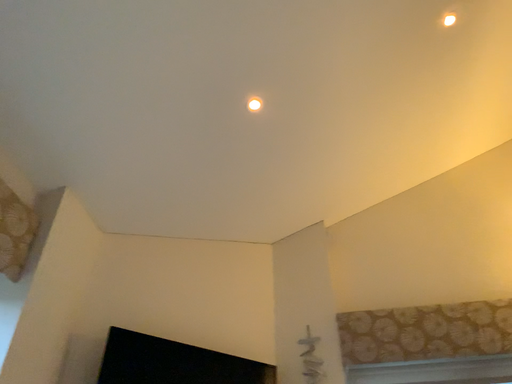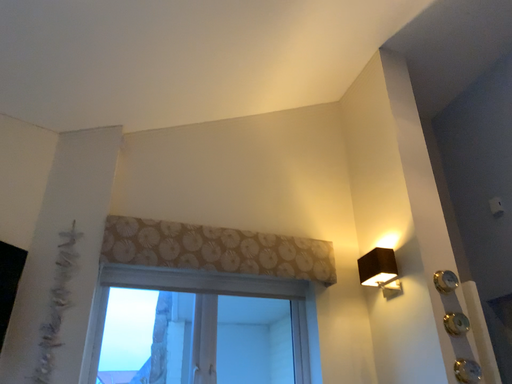
Question: Which way did the camera rotate in the video?

Choices:
 (A) rotated right
 (B) rotated left

Answer: (A)